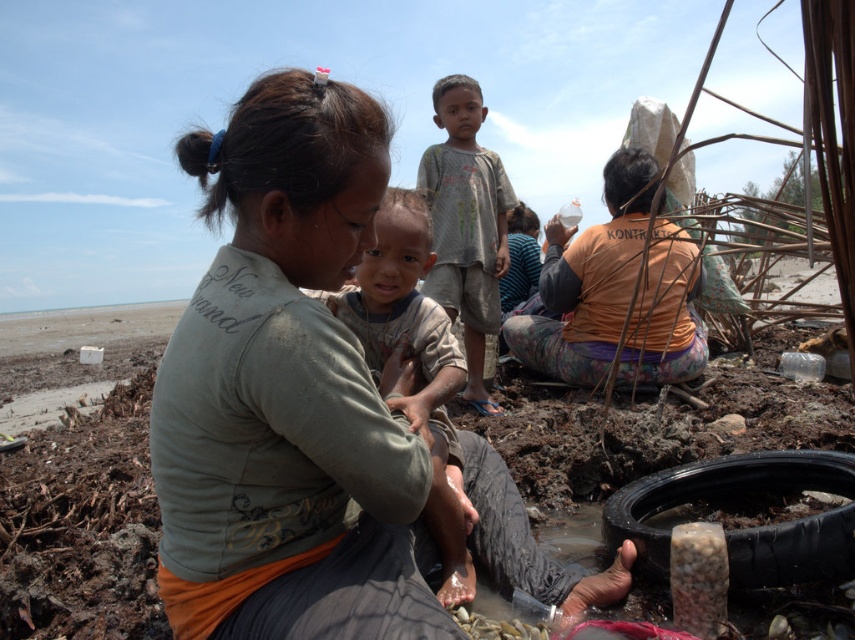
Question: Which point is farther to the camera?

Choices:
 (A) gray cotton shirt at center
 (B) orange fabric at center

Answer: (A)

Question: Which object appears closest to the camera in this image?

Choices:
 (A) dirty cloth shirt at center
 (B) orange fabric at center
 (C) gray cotton shirt at center
 (D) matte green shirt at center

Answer: (D)

Question: Which object appears closest to the camera in this image?

Choices:
 (A) dirty cloth shirt at center
 (B) black rubber tire at lower right
 (C) matte green shirt at center
 (D) gray cotton shirt at center

Answer: (C)

Question: Is matte green shirt at center positioned before dirty cloth shirt at center?

Choices:
 (A) yes
 (B) no

Answer: (A)

Question: Does matte green shirt at center have a greater width compared to orange fabric at center?

Choices:
 (A) no
 (B) yes

Answer: (A)

Question: From the image, what is the correct spatial relationship of matte green shirt at center in relation to orange fabric at center?

Choices:
 (A) right
 (B) left

Answer: (B)